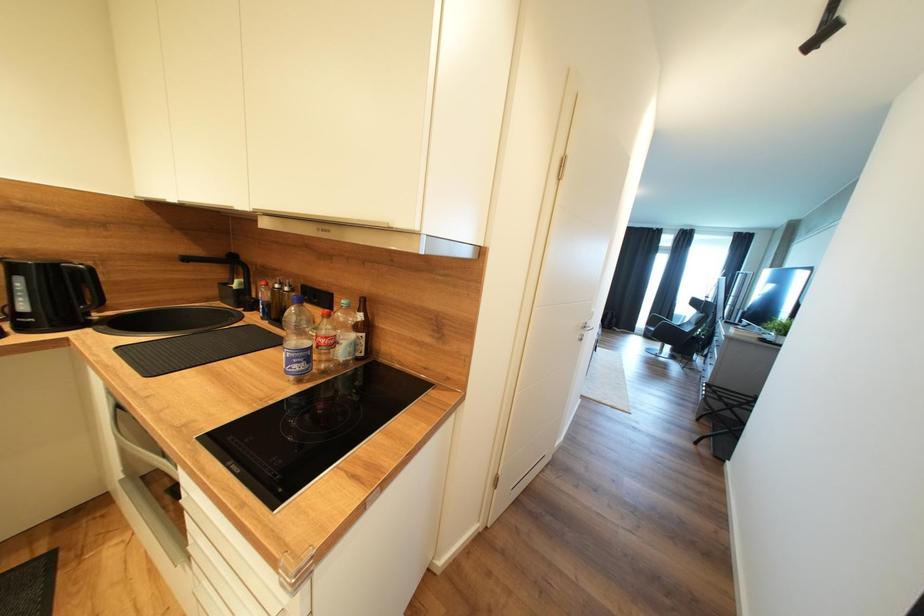
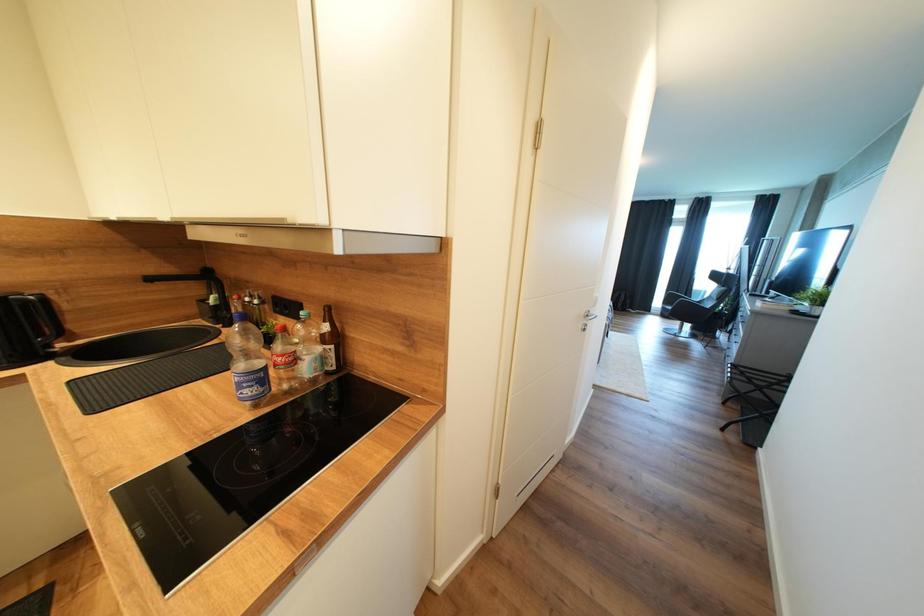
Which direction would the cameraman need to move to produce the second image?

The cameraman moved toward right, forward.